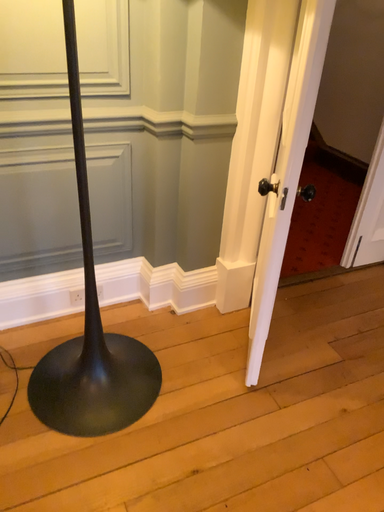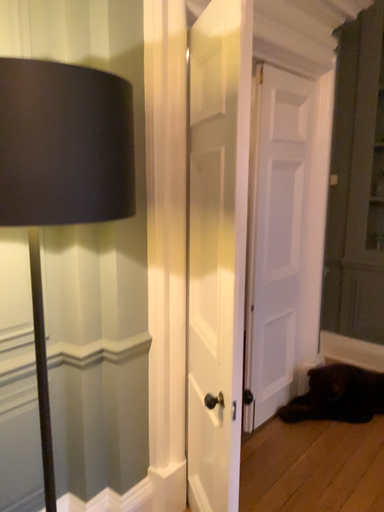
Question: How did the camera likely rotate when shooting the video?

Choices:
 (A) rotated left
 (B) rotated right

Answer: (B)